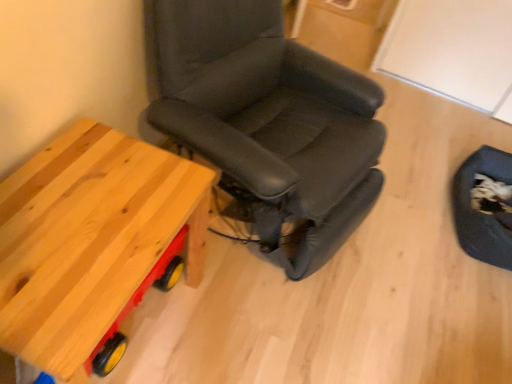
I want to click on vacant area that is situated to the right of black leather chair at center, so pos(416,248).